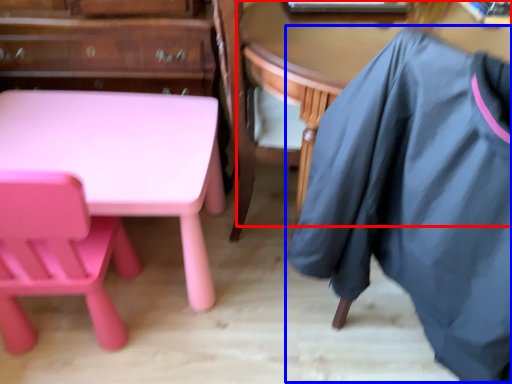
Question: Which object is further to the camera taking this photo, table (highlighted by a red box) or clothing (highlighted by a blue box)?

Choices:
 (A) table
 (B) clothing

Answer: (A)